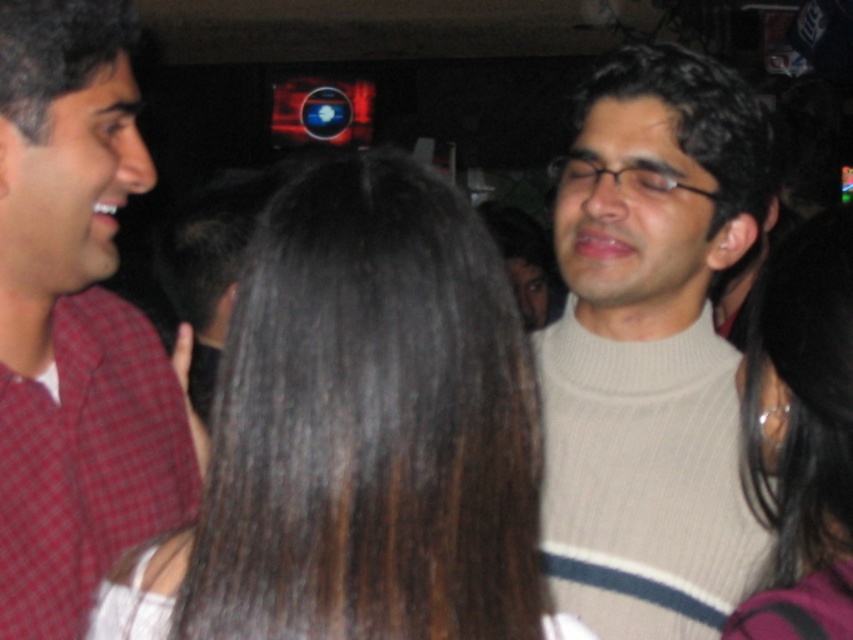
Question: Which point is closer to the camera?

Choices:
 (A) (747, 493)
 (B) (686, 102)

Answer: (A)

Question: Where is red plaid shirt at left located in relation to smooth black hair at right in the image?

Choices:
 (A) below
 (B) above

Answer: (B)

Question: Which is nearer to the beige ribbed sweater at center?

Choices:
 (A) red plaid shirt at left
 (B) brown hair at center

Answer: (B)

Question: Among these points, which one is farthest from the camera?

Choices:
 (A) (827, 481)
 (B) (434, 400)
 (C) (77, 116)

Answer: (C)

Question: Is red plaid shirt at left above smooth black hair at right?

Choices:
 (A) yes
 (B) no

Answer: (A)

Question: Can you confirm if brown hair at center is positioned to the right of red plaid shirt at left?

Choices:
 (A) no
 (B) yes

Answer: (B)